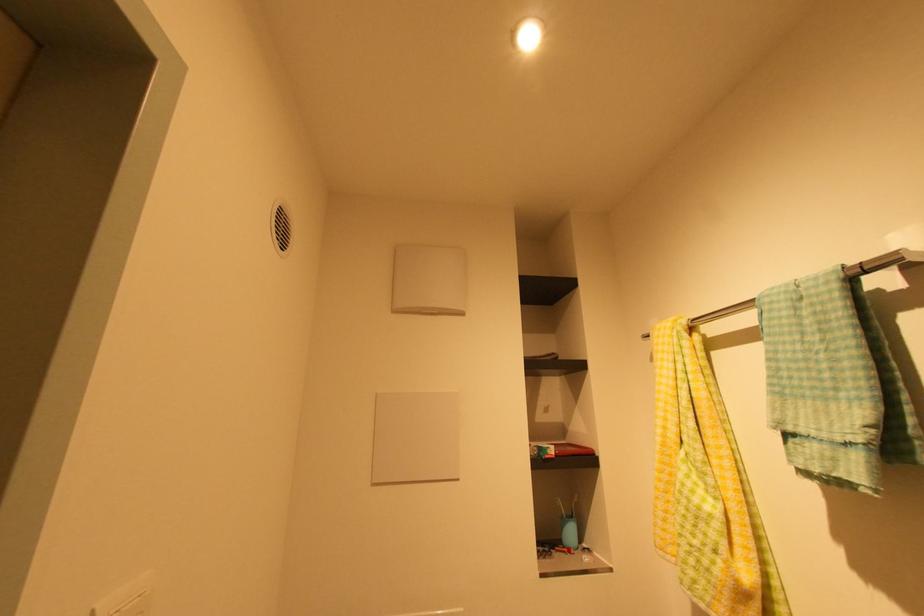
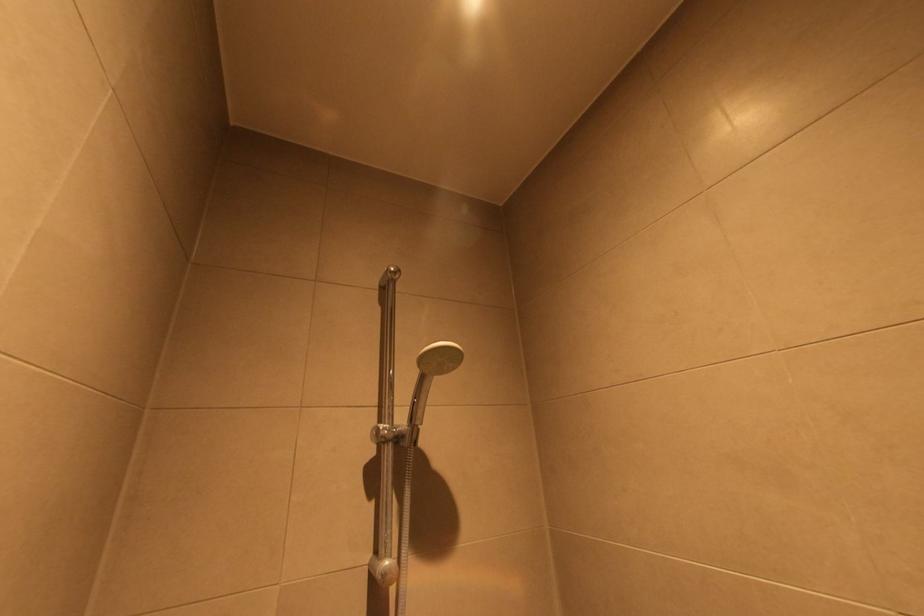
The images are taken continuously from a first-person perspective. In which direction is your viewpoint rotating?

The camera's rotation is toward right-up.